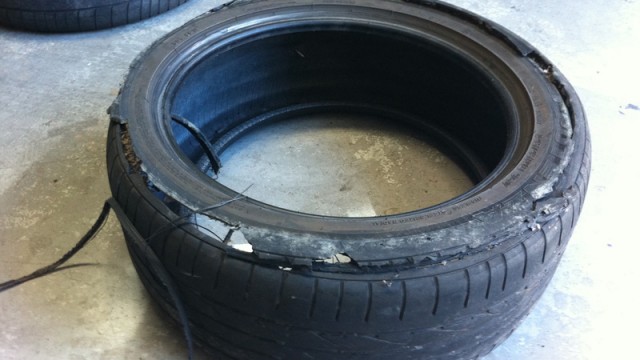
Locate an element on the screen. The image size is (640, 360). sidewall is located at coordinates (491, 195).